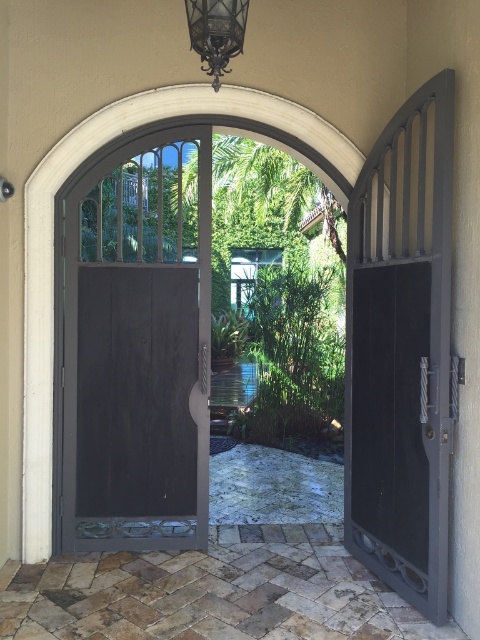
Question: Which object is closer to the camera taking this photo?

Choices:
 (A) dark wood door at center
 (B) black metal/light fixture at upper center

Answer: (B)

Question: In this image, where is dark wood door at center located relative to black metal/light fixture at upper center?

Choices:
 (A) above
 (B) below

Answer: (B)

Question: Which point is closer to the camera?

Choices:
 (A) dark wood door at center
 (B) black metal/light fixture at upper center

Answer: (B)

Question: Can you confirm if dark wood door at center is smaller than black metal/light fixture at upper center?

Choices:
 (A) yes
 (B) no

Answer: (B)

Question: Is dark wood door at center above black metal/light fixture at upper center?

Choices:
 (A) yes
 (B) no

Answer: (B)